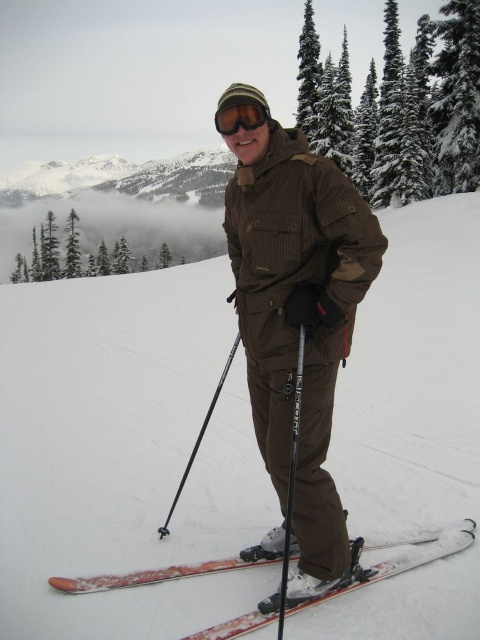
Question: Considering the real-world distances, which object is closest to the silver metallic ski pole at center?

Choices:
 (A) brown corduroy jacket at center
 (B) black matte ski pole at center

Answer: (A)

Question: Which point is farther to the camera?

Choices:
 (A) (295, 394)
 (B) (313, 508)
 (C) (81, 486)

Answer: (C)

Question: Which point is closer to the camera?

Choices:
 (A) black matte ski pole at center
 (B) brown corduroy jacket at center
 (C) matte black goggles at center
 (D) orange metallic skis at lower center

Answer: (D)

Question: Can you confirm if brown corduroy jacket at center is positioned to the right of black matte ski pole at center?

Choices:
 (A) yes
 (B) no

Answer: (A)

Question: Does brown corduroy jacket at center have a lesser width compared to black matte ski pole at center?

Choices:
 (A) yes
 (B) no

Answer: (B)

Question: From the image, what is the correct spatial relationship of brown corduroy jacket at center in relation to matte black goggles at center?

Choices:
 (A) above
 (B) below

Answer: (B)